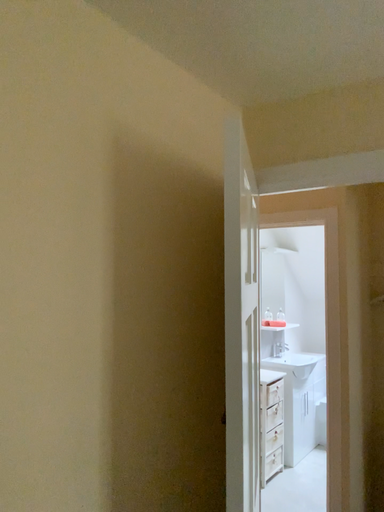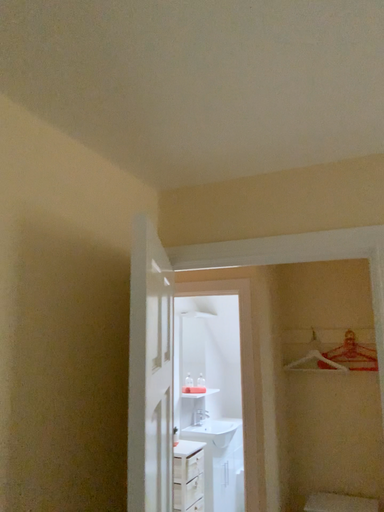
Question: How did the camera likely rotate when shooting the video?

Choices:
 (A) rotated downward
 (B) rotated upward

Answer: (B)